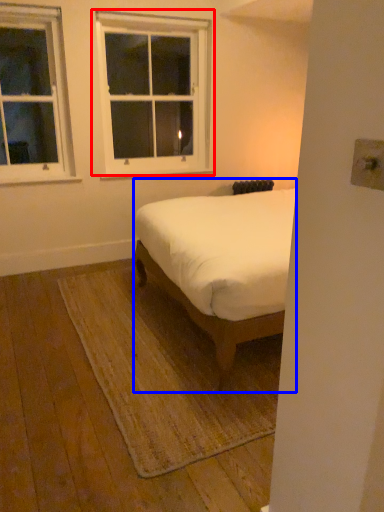
Question: Which object appears closest to the camera in this image, window (highlighted by a red box) or bed (highlighted by a blue box)?

Choices:
 (A) window
 (B) bed

Answer: (B)